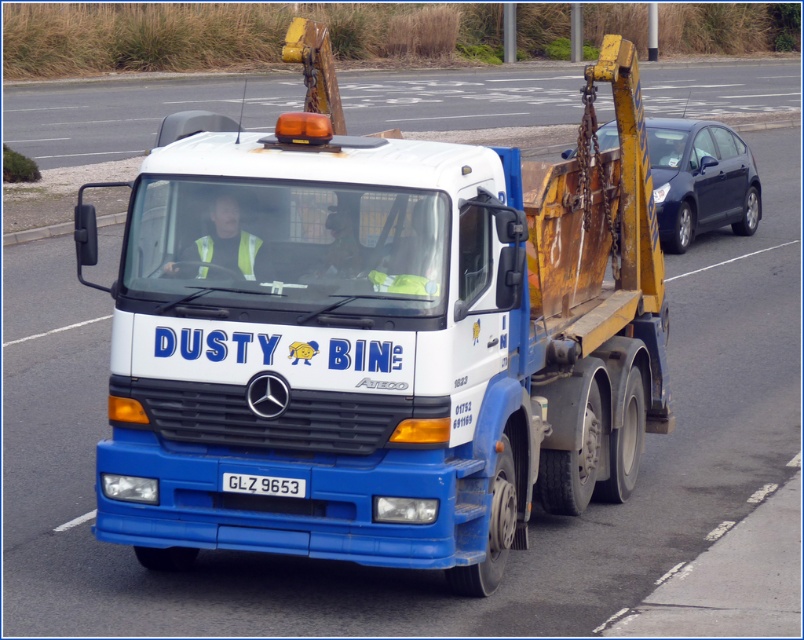
You are a traffic officer observing the road. You notice the white glossy truck at center and the matte black car at right. Which vehicle has a greater height?

The white glossy truck at center is much taller than the matte black car at right, so the white glossy truck at center has a greater height.

You are a pedestrian standing on the sidewalk observing the white glossy truck at center and the matte black car at right. Which vehicle is positioned closer to the left side of the road?

The white glossy truck at center is positioned to the left of the matte black car at right, so it is closer to the left side of the road.

You are standing on the side of the road and see the blue matte tow truck at center driving away. If you want to take a photo of it from where you are standing, would you need a zoom lens to capture the entire vehicle in the frame?

The blue matte tow truck at center is 29.37 feet away from you. Since most standard lenses can focus clearly at distances beyond 20 feet, you would not need a zoom lens to capture the entire vehicle in the frame.